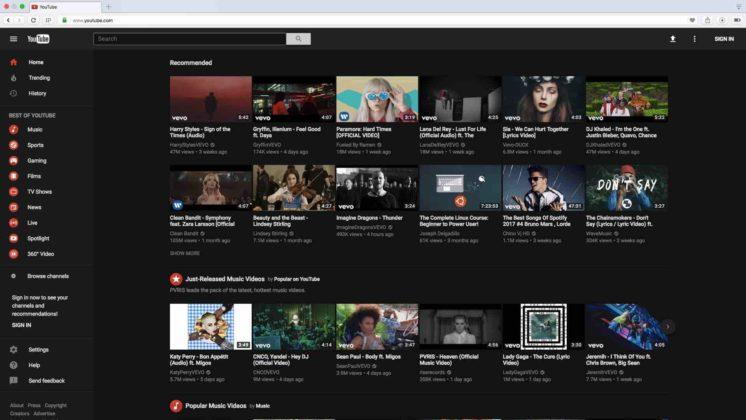
You are a GUI agent. You are given a task and a screenshot of the screen. Output one action in this format:
    pyautogui.click(x=<x>, y=<y>)
    Task: Click on the video game controller
    
    Given the screenshot: What is the action you would take?
    pyautogui.click(x=13, y=159)